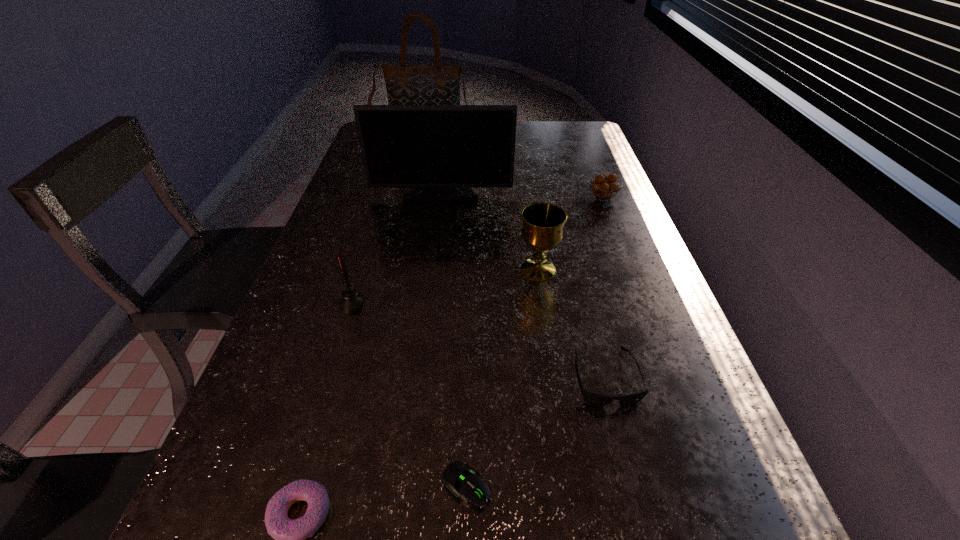
The width and height of the screenshot is (960, 540). What are the coordinates of `the tallest object` in the screenshot? It's located at (439, 84).

Find the location of a particular element. the farthest object is located at coordinates (439, 84).

I want to click on the second tallest object, so click(441, 151).

Find the location of a particular element. the fourth farthest object is located at coordinates (542, 231).

Where is `the fourth nearest object`? The width and height of the screenshot is (960, 540). the fourth nearest object is located at coordinates (351, 300).

Where is `the fifth tallest object`? This screenshot has height=540, width=960. the fifth tallest object is located at coordinates (602, 189).

Locate an element on the screen. the rightmost object is located at coordinates (602, 189).

The height and width of the screenshot is (540, 960). I want to click on the sixth farthest object, so click(x=592, y=398).

Where is `computer mouse`? The height and width of the screenshot is (540, 960). computer mouse is located at coordinates (460, 480).

The width and height of the screenshot is (960, 540). What are the coordinates of `free space located 0.190m on the front-facing side of the farthest object` in the screenshot? It's located at (417, 171).